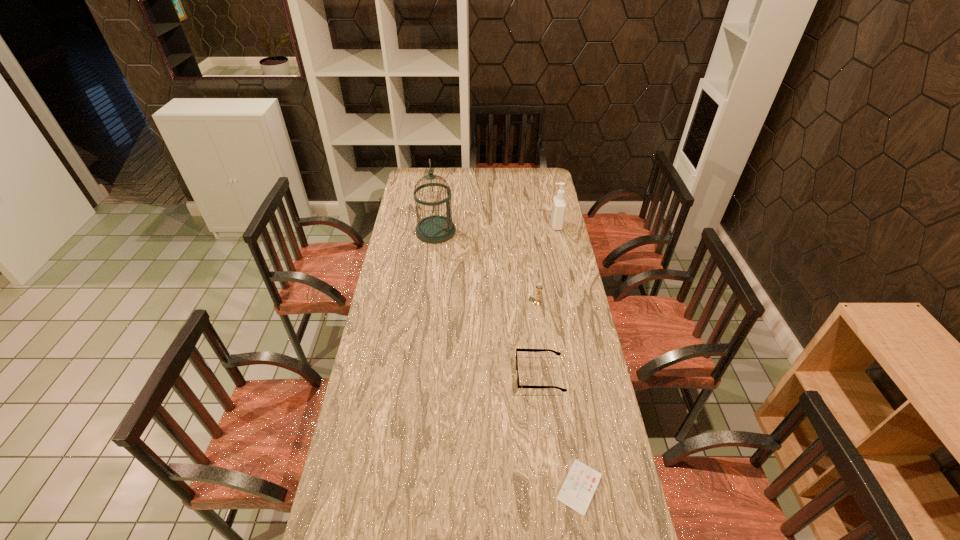
Image resolution: width=960 pixels, height=540 pixels. Find the location of `vacant space that satisfies the following two spatial constraints: 1. on the back side of the third nearest object; 2. on the front-facing side of the tallest object`. vacant space that satisfies the following two spatial constraints: 1. on the back side of the third nearest object; 2. on the front-facing side of the tallest object is located at coordinates (528, 232).

You are a GUI agent. You are given a task and a screenshot of the screen. Output one action in this format:
    pyautogui.click(x=<x>, y=<y>)
    Task: Click on the free spot that satisfies the following two spatial constraints: 1. on the front label of the cleansing agent; 2. on the front side of the shortest object
    
    Given the screenshot: What is the action you would take?
    pyautogui.click(x=611, y=487)

Locate an element on the screen. Image resolution: width=960 pixels, height=540 pixels. free spot that satisfies the following two spatial constraints: 1. on the back side of the shortest object; 2. on the front-facing side of the birdcage is located at coordinates (539, 232).

Identify the location of free space in the image that satisfies the following two spatial constraints: 1. on the front-facing side of the shortest object; 2. on the right side of the leftmost object. (405, 487).